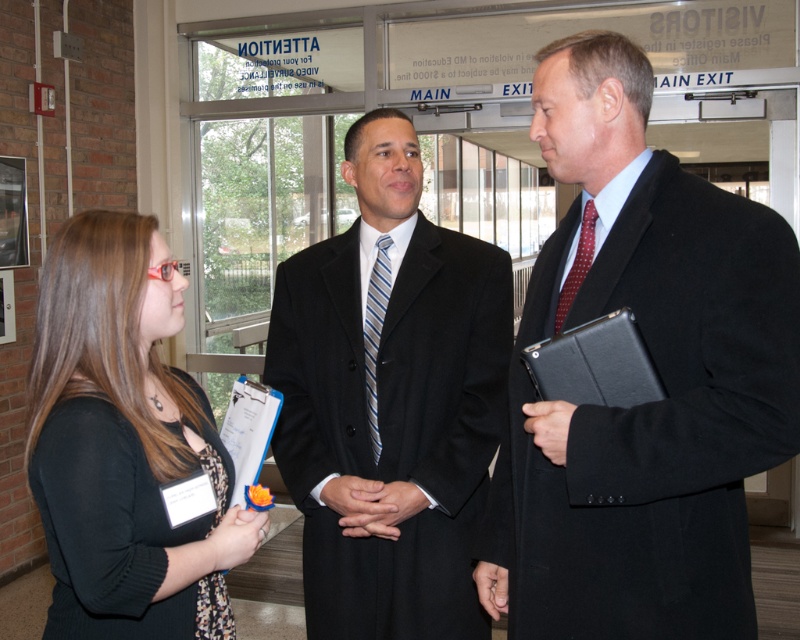
Question: Can you confirm if matte black coat at center is positioned above blue striped tie at center?

Choices:
 (A) no
 (B) yes

Answer: (B)

Question: Based on their relative distances, which object is nearer to the red dotted tie at center?

Choices:
 (A) matte black dress at left
 (B) blue striped tie at center
 (C) black suit at center

Answer: (B)

Question: Does matte black dress at left have a lesser width compared to blue striped tie at center?

Choices:
 (A) no
 (B) yes

Answer: (A)

Question: Which object is positioned farthest from the matte black coat at center?

Choices:
 (A) red dotted tie at center
 (B) blue striped tie at center

Answer: (B)

Question: Estimate the real-world distances between objects in this image. Which object is farther from the blue striped tie at center?

Choices:
 (A) red dotted tie at center
 (B) matte black coat at center
 (C) black suit at center
 (D) matte black dress at left

Answer: (B)

Question: Does matte black dress at left have a greater width compared to red dotted tie at center?

Choices:
 (A) yes
 (B) no

Answer: (A)